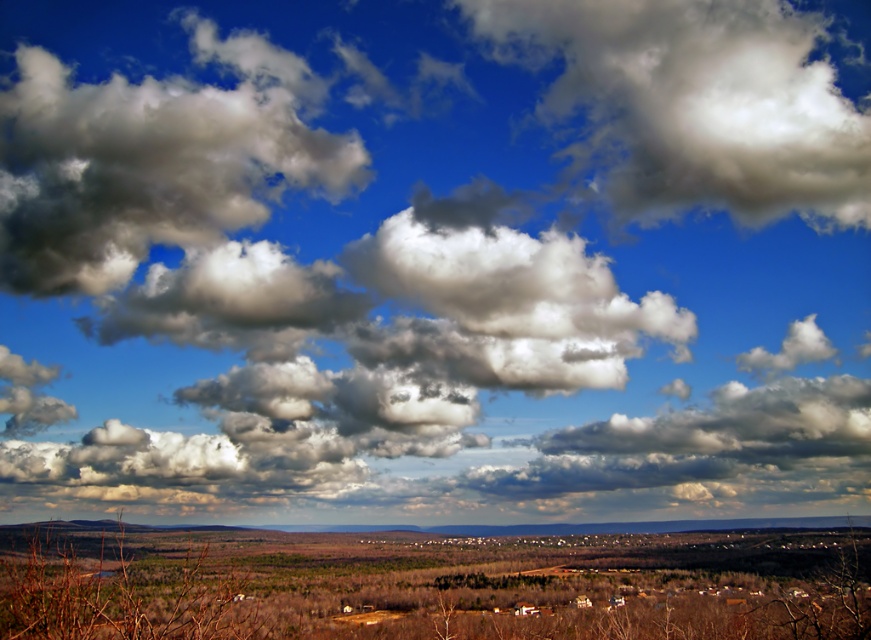
Describe the element at coordinates (430, 582) in the screenshot. I see `brown dry grassland at lower center` at that location.

Is brown dry grassland at lower center thinner than white fluffy cloud at center?

Incorrect, brown dry grassland at lower center's width is not less than white fluffy cloud at center's.

The image size is (871, 640). What do you see at coordinates (430, 582) in the screenshot?
I see `brown dry grassland at lower center` at bounding box center [430, 582].

Find the location of a particular element. brown dry grassland at lower center is located at coordinates (430, 582).

The image size is (871, 640). Describe the element at coordinates (697, 104) in the screenshot. I see `white fluffy cloud at upper center` at that location.

Does white fluffy cloud at upper center have a greater width compared to cloudy white at left?

Indeed, white fluffy cloud at upper center has a greater width compared to cloudy white at left.

Is point (685, 4) positioned after point (273, 68)?

Yes.

The image size is (871, 640). Find the location of `white fluffy cloud at upper center`. white fluffy cloud at upper center is located at coordinates (697, 104).

Who is higher up, white fluffy cloud at center or brown grassland at lower center?

Positioned higher is white fluffy cloud at center.

Does point (402, 259) come in front of point (450, 534)?

No, it is not.

Find the location of a particular element. The image size is (871, 640). white fluffy cloud at center is located at coordinates (504, 301).